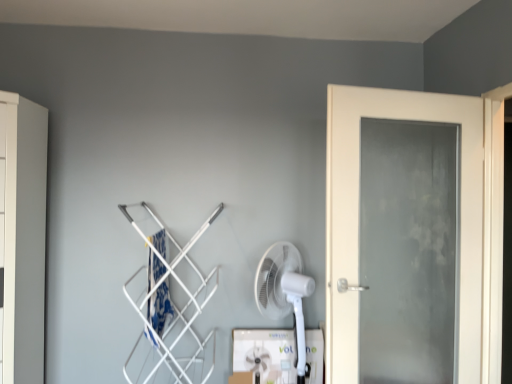
This screenshot has height=384, width=512. Describe the element at coordinates (284, 293) in the screenshot. I see `white plastic mechanical fan at right` at that location.

At what (x,y) coordinates should I click in order to perform the action: click on white plastic mechanical fan at right. Please return your answer as a coordinate pair (x, y). The width and height of the screenshot is (512, 384). Looking at the image, I should click on (284, 293).

At what (x,y) coordinates should I click in order to perform the action: click on white plastic mechanical fan at right. Please return your answer as a coordinate pair (x, y). Looking at the image, I should click on pos(284,293).